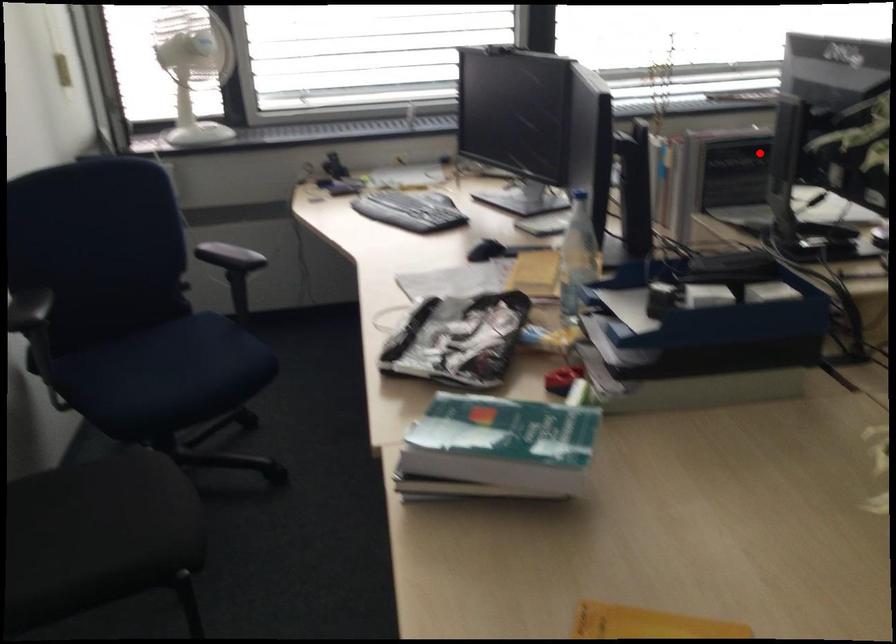
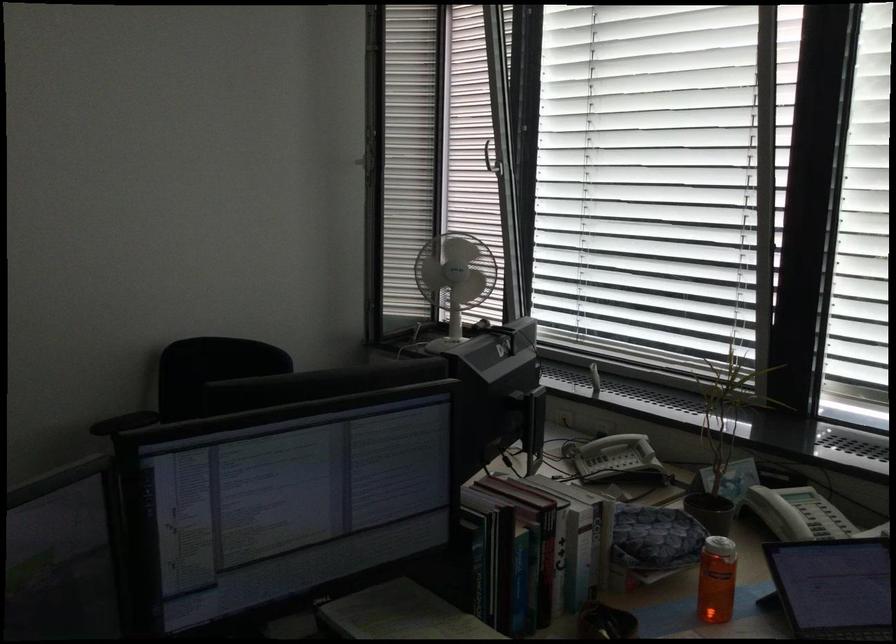
Question: I am providing you with two images of the same scene from different viewpoints. Image1 has a red point marked. In image2, the corresponding 3D location appears at what relative position? Reply with the corresponding letter.

Choices:
 (A) Closer
 (B) Farther

Answer: (A)